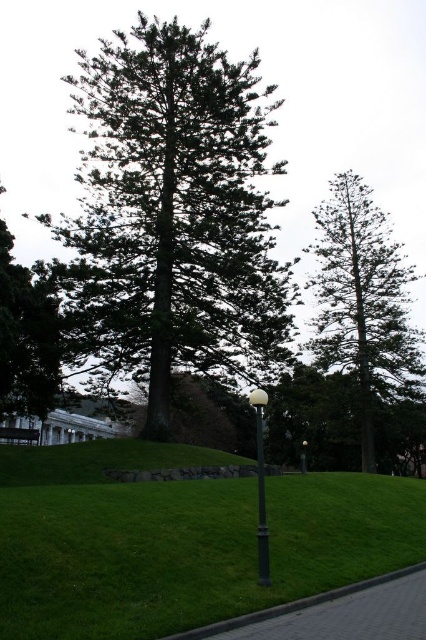
Does point (204, 182) come farther from viewer compared to point (302, 445)?

No.

Does point (264, 161) lie in front of point (305, 444)?

That is False.

Find the location of a particular element. This screenshot has height=640, width=426. green textured tree at center is located at coordinates (173, 214).

Is green textured tree at center shorter than wooden park bench at lower left?

No.

Is green textured tree at center to the left of wooden park bench at lower left from the viewer's perspective?

No, green textured tree at center is not to the left of wooden park bench at lower left.

Locate an element on the screen. The image size is (426, 640). green textured tree at center is located at coordinates (173, 214).

Which is more to the right, green matte tree at upper left or matte black lamp post at center?

matte black lamp post at center is more to the right.

Is the position of green matte tree at upper left less distant than that of matte black lamp post at center?

Yes, it is in front of matte black lamp post at center.

Is point (36, 353) farther from camera compared to point (305, 452)?

No, it is not.

The height and width of the screenshot is (640, 426). Find the location of `green matte tree at upper left`. green matte tree at upper left is located at coordinates (25, 337).